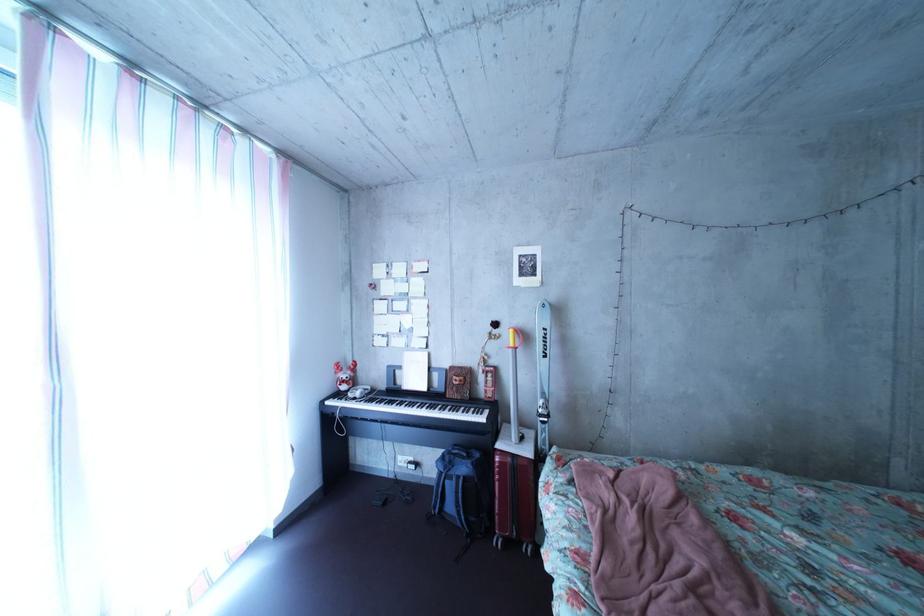
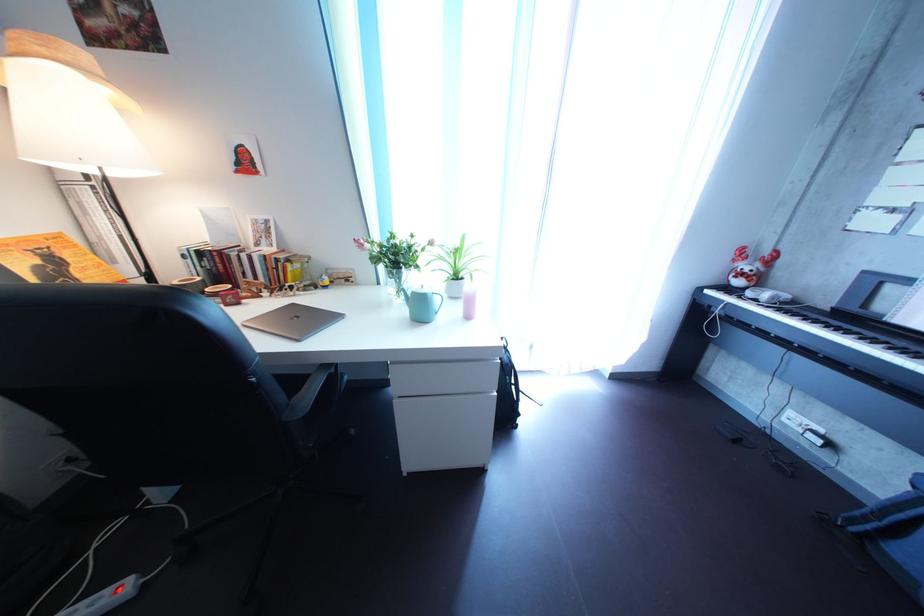
The images are taken continuously from a first-person perspective. In which direction is your viewpoint rotating?

The rotation direction of the camera is left-down.